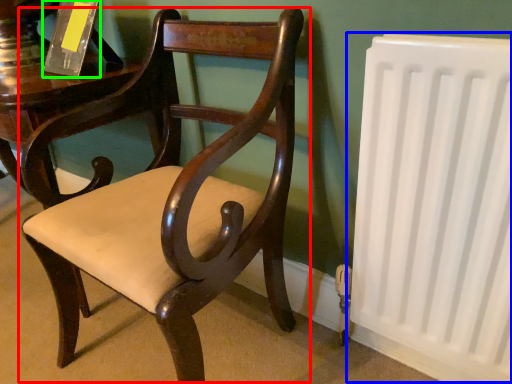
Question: Based on their relative distances, which object is farther from chair (highlighted by a red box)? Choose from radiator (highlighted by a blue box) and paperback book (highlighted by a green box).

Choices:
 (A) radiator
 (B) paperback book

Answer: (B)